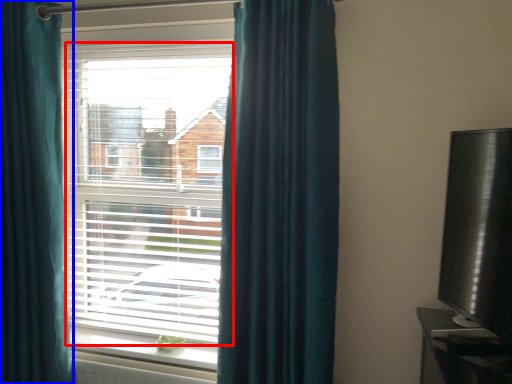
Question: Which object is further to the camera taking this photo, bay window (highlighted by a red box) or curtain (highlighted by a blue box)?

Choices:
 (A) bay window
 (B) curtain

Answer: (A)